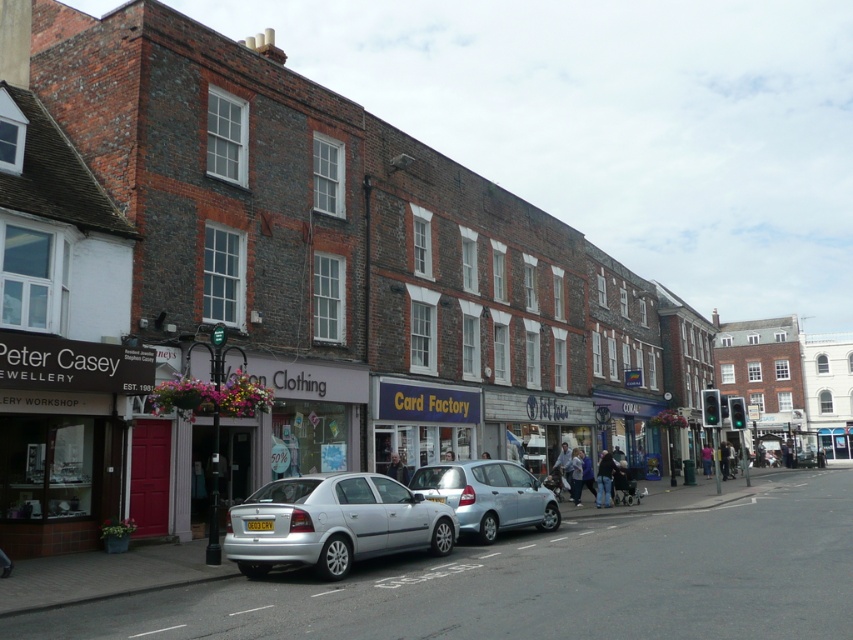
Question: Estimate the real-world distances between objects in this image. Which object is closer to the dark blue jeans at center?

Choices:
 (A) silver metallic car at center
 (B) light brown leather jacket at center
 (C) silver metallic hatchback at center
 (D) light blue jeans at center

Answer: (D)

Question: Observing the image, what is the correct spatial positioning of silver metallic car at center in reference to dark blue jeans at center?

Choices:
 (A) right
 (B) left

Answer: (B)

Question: Which of the following is the closest to the observer?

Choices:
 (A) silver metallic hatchback at center
 (B) light blue jeans at center

Answer: (A)

Question: Where is silver metallic hatchback at center located in relation to light brown leather jacket at center in the image?

Choices:
 (A) left
 (B) right

Answer: (B)

Question: Which point appears farthest from the camera in this image?

Choices:
 (A) (573, 470)
 (B) (392, 452)

Answer: (A)

Question: Can you confirm if dark blue jeans at center is smaller than light blue jeans at center?

Choices:
 (A) no
 (B) yes

Answer: (A)